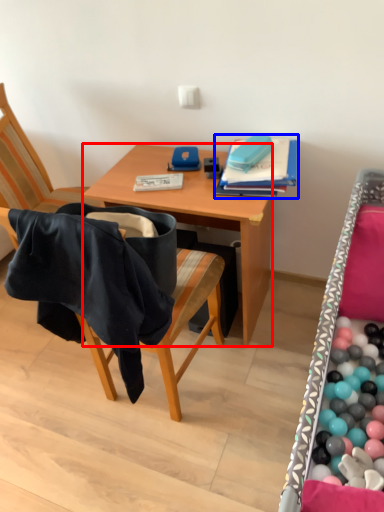
Question: Among these objects, which one is farthest to the camera, desk (highlighted by a red box) or book (highlighted by a blue box)?

Choices:
 (A) desk
 (B) book

Answer: (B)